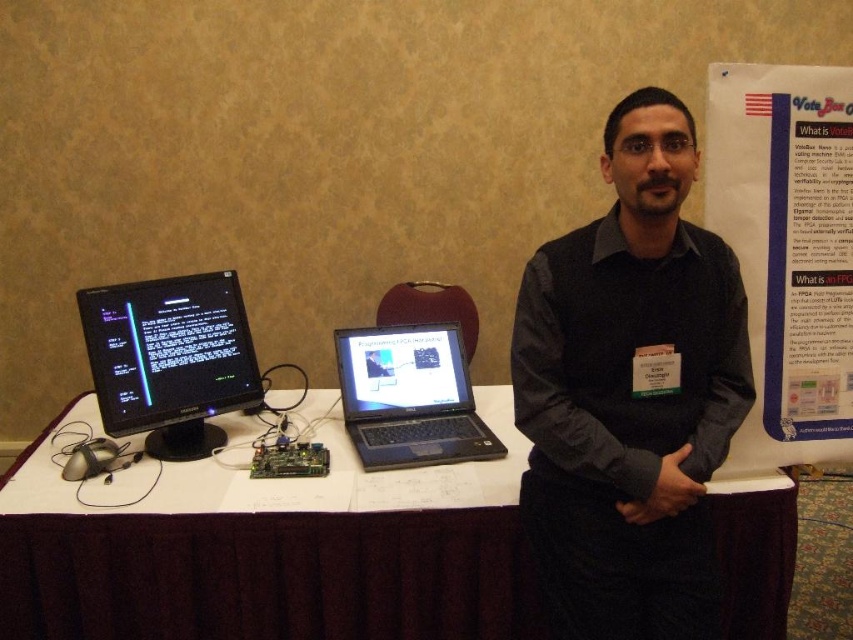
Does black matte shirt at center have a greater height compared to white tablecloth at center?

Yes, black matte shirt at center is taller than white tablecloth at center.

Between black matte shirt at center and white tablecloth at center, which one appears on the right side from the viewer's perspective?

Positioned to the right is black matte shirt at center.

Who is more forward, [619,616] or [439,572]?

Positioned in front is point [619,616].

At what (x,y) coordinates should I click in order to perform the action: click on black matte shirt at center. Please return your answer as a coordinate pair (x, y). This screenshot has width=853, height=640. Looking at the image, I should click on (630, 392).

Can you confirm if white paper at upper right is thinner than black glossy laptop at center?

Yes, white paper at upper right is thinner than black glossy laptop at center.

Which is more to the right, white paper at upper right or black glossy laptop at center?

white paper at upper right is more to the right.

Does point (793, 392) lie in front of point (358, 364)?

Yes, point (793, 392) is closer to viewer.

Locate an element on the screen. The image size is (853, 640). white paper at upper right is located at coordinates (787, 250).

Is white tablecloth at center wider than black glossy laptop at center?

Indeed, white tablecloth at center has a greater width compared to black glossy laptop at center.

This screenshot has width=853, height=640. What do you see at coordinates (270, 564) in the screenshot?
I see `white tablecloth at center` at bounding box center [270, 564].

Where is `white tablecloth at center`? The height and width of the screenshot is (640, 853). white tablecloth at center is located at coordinates coord(270,564).